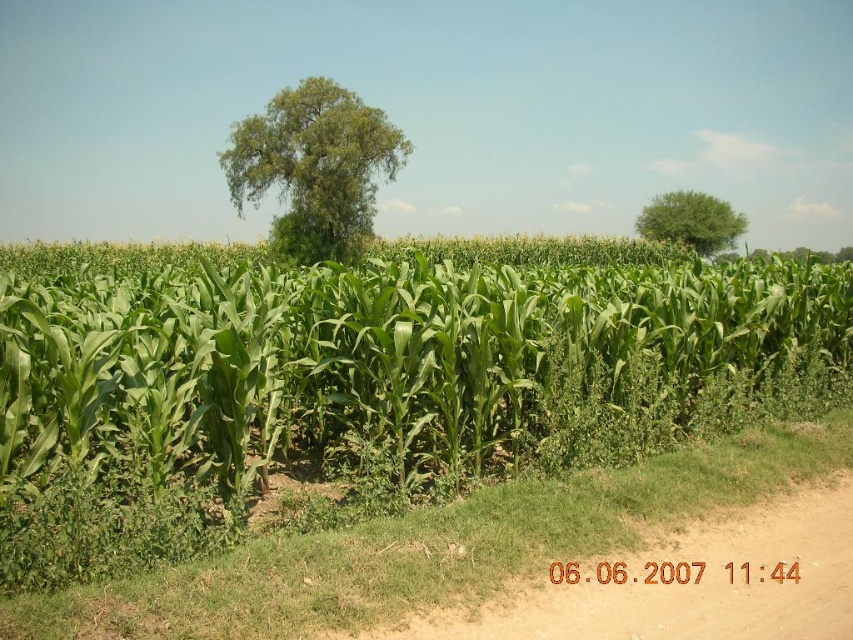
Is brown dirt track at lower right shorter than green leafy tree at center?

Yes, brown dirt track at lower right is shorter than green leafy tree at center.

The image size is (853, 640). Describe the element at coordinates (686, 582) in the screenshot. I see `brown dirt track at lower right` at that location.

The height and width of the screenshot is (640, 853). I want to click on brown dirt track at lower right, so coord(686,582).

Consider the image. Is brown dirt track at lower right smaller than green leafy tree at upper right?

Yes, brown dirt track at lower right is smaller than green leafy tree at upper right.

Does brown dirt track at lower right appear on the left side of green leafy tree at upper right?

Indeed, brown dirt track at lower right is positioned on the left side of green leafy tree at upper right.

Image resolution: width=853 pixels, height=640 pixels. I want to click on brown dirt track at lower right, so click(686, 582).

Can you confirm if green leafy corn at center is smaller than green leafy tree at center?

Incorrect, green leafy corn at center is not smaller in size than green leafy tree at center.

Between green leafy corn at center and green leafy tree at center, which one appears on the left side from the viewer's perspective?

green leafy tree at center

Is point (668, 268) farther from camera compared to point (297, 106)?

No.

The image size is (853, 640). What are the coordinates of `green leafy corn at center` in the screenshot? It's located at (364, 355).